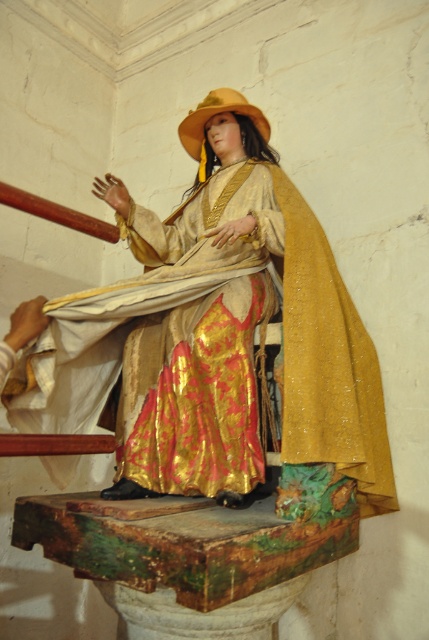
Image resolution: width=429 pixels, height=640 pixels. Describe the element at coordinates (215, 352) in the screenshot. I see `gold shiny dress at center` at that location.

Which is below, gold shiny dress at center or golden textured hat at upper center?

gold shiny dress at center

In order to click on gold shiny dress at center in this screenshot , I will do `click(215, 352)`.